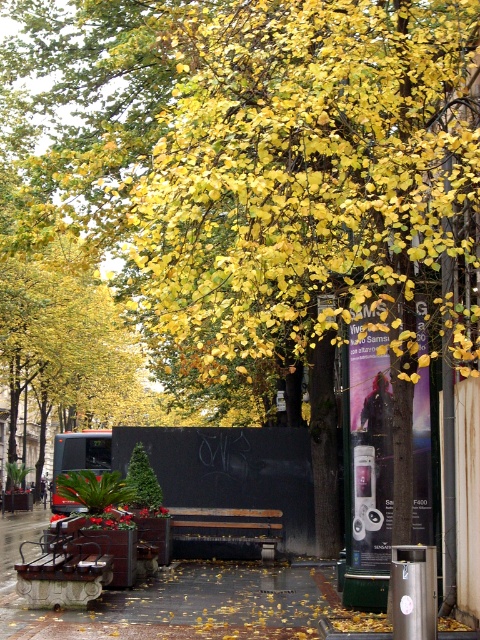
Can you confirm if rustic wood bench at lower left is positioned to the right of rusty metal bench at center?

No, rustic wood bench at lower left is not to the right of rusty metal bench at center.

Who is higher up, rustic wood bench at lower left or rusty metal bench at center?

rustic wood bench at lower left is higher up.

Does point (52, 538) come closer to viewer compared to point (248, 528)?

Yes, it is.

This screenshot has height=640, width=480. What are the coordinates of `rustic wood bench at lower left` in the screenshot? It's located at (63, 566).